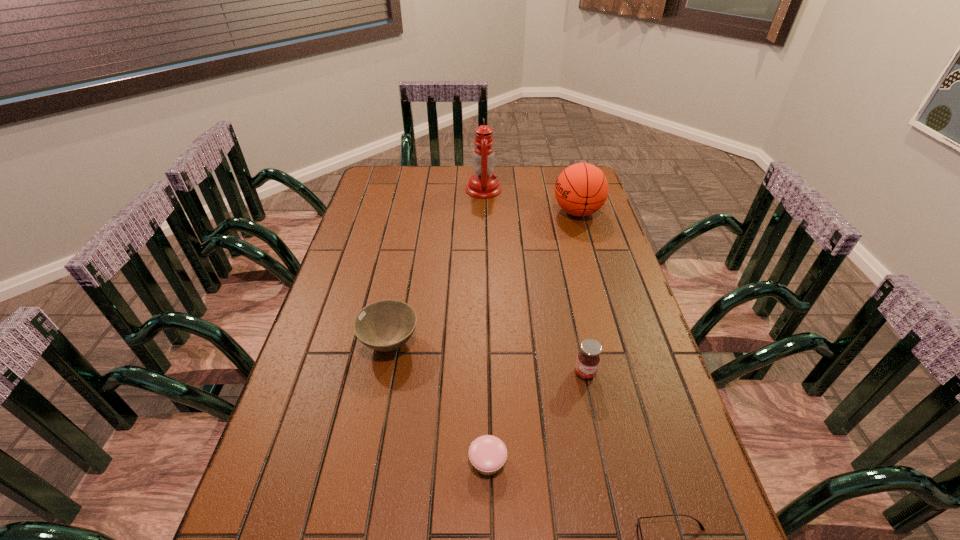
Locate an element on the screen. Image resolution: width=960 pixels, height=540 pixels. empty space that is in between the tallest object and the fifth tallest object is located at coordinates (486, 326).

Where is `empty space between the cupcake and the fifth shortest object`? The height and width of the screenshot is (540, 960). empty space between the cupcake and the fifth shortest object is located at coordinates (533, 337).

Find the location of a particular element. This screenshot has width=960, height=540. free space between the basketball and the fourth shortest object is located at coordinates (582, 292).

Locate an element on the screen. Image resolution: width=960 pixels, height=540 pixels. empty location between the jam and the second nearest object is located at coordinates (537, 417).

The width and height of the screenshot is (960, 540). What are the coordinates of `free space between the leftmost object and the fifth shortest object` in the screenshot? It's located at (484, 278).

Locate an element on the screen. vacant area that lies between the oil lamp and the cupcake is located at coordinates (486, 326).

At what (x,y) coordinates should I click in order to perform the action: click on vacant area that lies between the fourth tallest object and the jam. Please return your answer as a coordinate pair (x, y). Image resolution: width=960 pixels, height=540 pixels. Looking at the image, I should click on (488, 358).

This screenshot has width=960, height=540. Find the location of `empty space that is in between the tallest object and the fifth shortest object`. empty space that is in between the tallest object and the fifth shortest object is located at coordinates (531, 201).

Locate an element on the screen. The image size is (960, 540). object that ranks as the third closest to the spectacles is located at coordinates (386, 325).

Image resolution: width=960 pixels, height=540 pixels. Identify the location of the second closest object to the fourth shortest object. (639, 534).